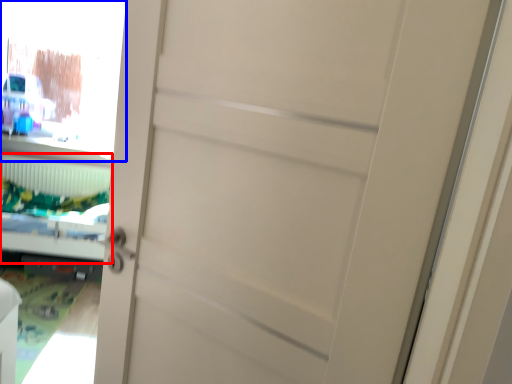
Question: Among these objects, which one is nearest to the camera, bed (highlighted by a red box) or window screen (highlighted by a blue box)?

Choices:
 (A) bed
 (B) window screen

Answer: (A)